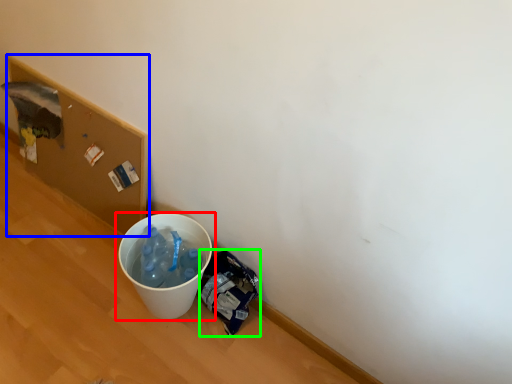
Question: Which object is positioned closest to waste container (highlighted by a red box)? Select from cardboard box (highlighted by a blue box) and garbage (highlighted by a green box).

Choices:
 (A) cardboard box
 (B) garbage

Answer: (B)